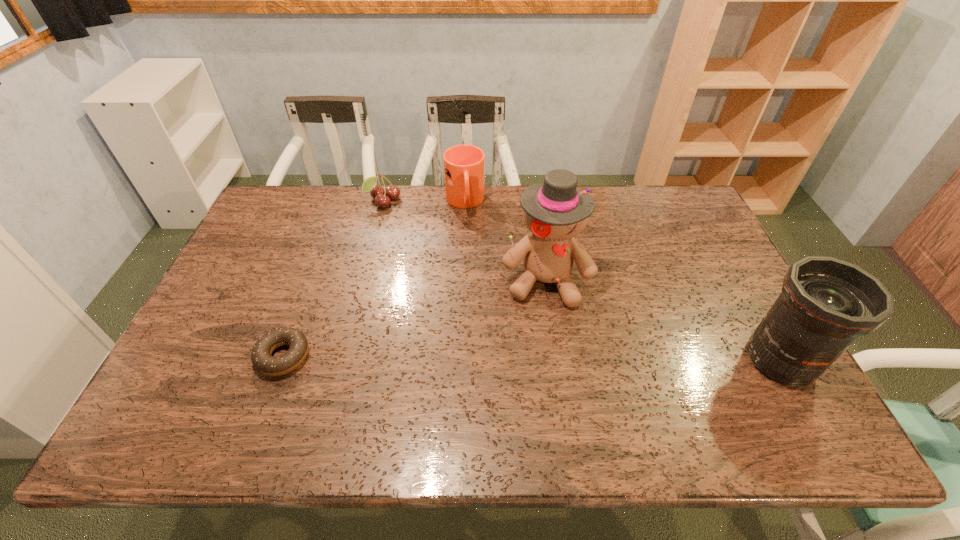
Find the location of a particular element. Image resolution: width=960 pixels, height=540 pixels. vacant spot on the desktop that is between the shortest object and the fourth shortest object and is positioned on the handle side of the third shortest object is located at coordinates (501, 358).

At what (x,y) coordinates should I click in order to perform the action: click on free spot on the desktop that is between the leftmost object and the rightmost object and is positioned on the front-facing side of the third nearest object. Please return your answer as a coordinate pair (x, y). This screenshot has width=960, height=540. Looking at the image, I should click on (542, 358).

Image resolution: width=960 pixels, height=540 pixels. What are the coordinates of `free space on the desktop that is between the shortest object and the fourth shortest object and is positioned on the leaves of the cherry` in the screenshot? It's located at (503, 358).